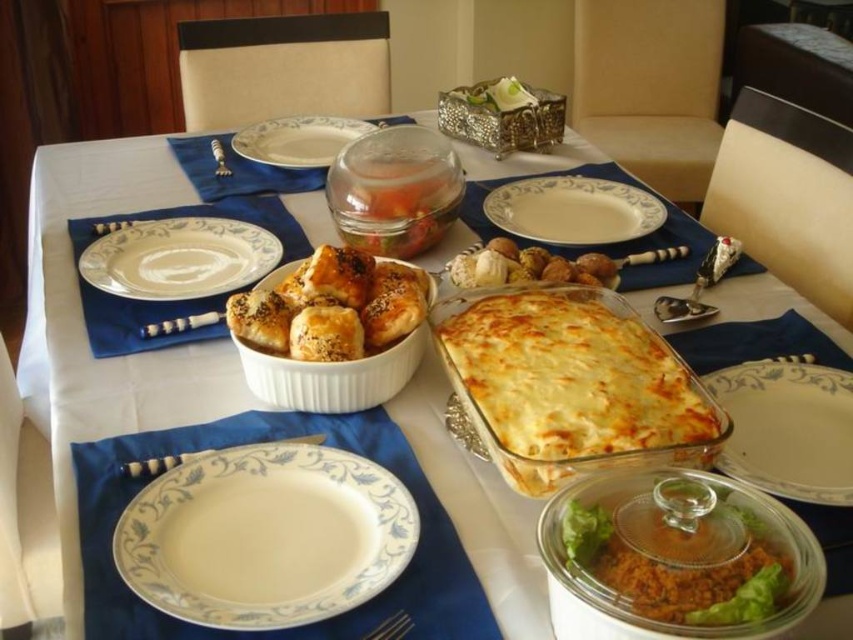
From the picture: You are a guest at the dinner and want to choose between the golden brown flaky pastry at center and the clear glass bowl at center. Which one is smaller in size?

The golden brown flaky pastry at center is smaller than the clear glass bowl at center.